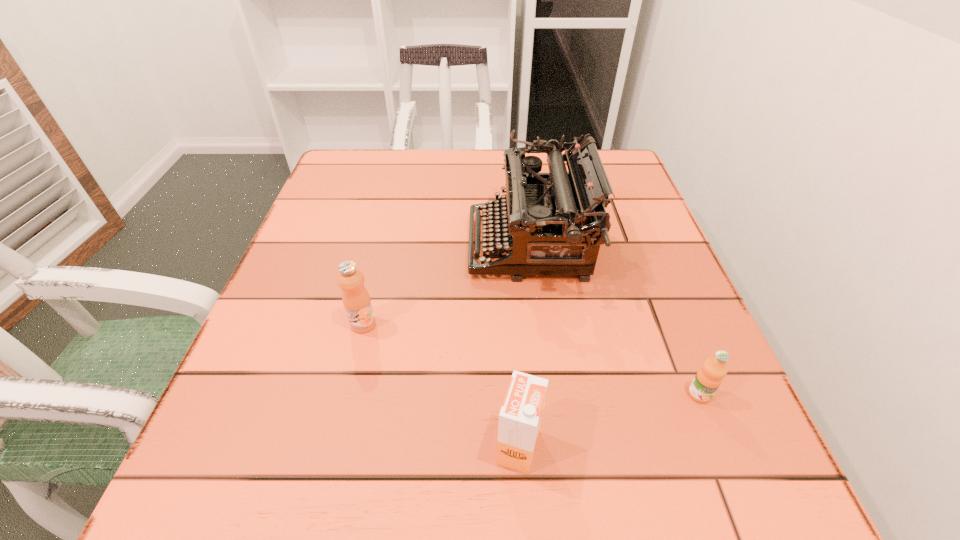
Locate an element on the screen. vacant space situated 0.150m on the keyboard of the typewriter is located at coordinates (397, 245).

Find the location of a particular element. This screenshot has width=960, height=540. vacant position located 0.200m on the front label of the leftmost orange juice is located at coordinates (333, 448).

At what (x,y) coordinates should I click in order to perform the action: click on vacant space located on the right of the nearest orange juice. Please return your answer as a coordinate pair (x, y). The image size is (960, 540). Looking at the image, I should click on (599, 447).

You are a GUI agent. You are given a task and a screenshot of the screen. Output one action in this format:
    pyautogui.click(x=<x>, y=<y>)
    Task: Click on the free space located on the label of the shortest object
    This screenshot has width=960, height=540.
    Given the screenshot: What is the action you would take?
    pyautogui.click(x=747, y=512)

You are a GUI agent. You are given a task and a screenshot of the screen. Output one action in this format:
    pyautogui.click(x=<x>, y=<y>)
    Task: Click on the object situated at the far edge
    
    Given the screenshot: What is the action you would take?
    pyautogui.click(x=554, y=223)

Where is `object present at the near edge`? Image resolution: width=960 pixels, height=540 pixels. object present at the near edge is located at coordinates (520, 417).

What are the coordinates of `object that is at the left edge` in the screenshot? It's located at (356, 300).

I want to click on typewriter at the right edge, so click(554, 223).

Where is `orange juice that is at the right edge`? orange juice that is at the right edge is located at coordinates (709, 377).

You are a GUI agent. You are given a task and a screenshot of the screen. Output one action in this format:
    pyautogui.click(x=<x>, y=<y>)
    Task: Click on the object that is at the far right corner
    
    Given the screenshot: What is the action you would take?
    pyautogui.click(x=554, y=223)